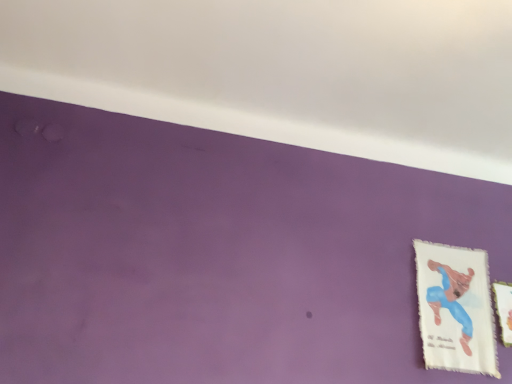
Question: Does white fabric picture frame at right, placed as the second picture frame when sorted from left to right, lie behind white fabric picture frame at lower right, which is the second picture frame in right-to-left order?

Choices:
 (A) no
 (B) yes

Answer: (B)

Question: Can you confirm if white fabric picture frame at right, placed as the second picture frame when sorted from left to right, is bigger than white fabric picture frame at lower right, acting as the first picture frame starting from the left?

Choices:
 (A) no
 (B) yes

Answer: (A)

Question: Is white fabric picture frame at right, the 1th picture frame when ordered from right to left, looking in the opposite direction of white fabric picture frame at lower right, which is the second picture frame in right-to-left order?

Choices:
 (A) no
 (B) yes

Answer: (A)

Question: Would you say white fabric picture frame at right, placed as the second picture frame when sorted from left to right, contains white fabric picture frame at lower right, which is the second picture frame in right-to-left order?

Choices:
 (A) no
 (B) yes

Answer: (A)

Question: From a real-world perspective, is white fabric picture frame at right, the 1th picture frame when ordered from right to left, below white fabric picture frame at lower right, acting as the first picture frame starting from the left?

Choices:
 (A) no
 (B) yes

Answer: (A)

Question: Is white fabric picture frame at right, placed as the second picture frame when sorted from left to right, far from white fabric picture frame at lower right, acting as the first picture frame starting from the left?

Choices:
 (A) no
 (B) yes

Answer: (A)

Question: Could you tell me if white fabric picture frame at lower right, acting as the first picture frame starting from the left, is turned towards white fabric picture frame at right, the 1th picture frame when ordered from right to left?

Choices:
 (A) no
 (B) yes

Answer: (A)

Question: From a real-world perspective, is white fabric picture frame at lower right, which is the second picture frame in right-to-left order, on white fabric picture frame at right, placed as the second picture frame when sorted from left to right?

Choices:
 (A) no
 (B) yes

Answer: (A)

Question: Is white fabric picture frame at right, placed as the second picture frame when sorted from left to right, completely or partially inside white fabric picture frame at lower right, acting as the first picture frame starting from the left?

Choices:
 (A) no
 (B) yes

Answer: (A)

Question: Does white fabric picture frame at lower right, acting as the first picture frame starting from the left, appear on the right side of white fabric picture frame at right, the 1th picture frame when ordered from right to left?

Choices:
 (A) no
 (B) yes

Answer: (A)

Question: Is white fabric picture frame at lower right, which is the second picture frame in right-to-left order, shorter than white fabric picture frame at right, the 1th picture frame when ordered from right to left?

Choices:
 (A) yes
 (B) no

Answer: (B)

Question: Is white fabric picture frame at lower right, acting as the first picture frame starting from the left, positioned before white fabric picture frame at right, the 1th picture frame when ordered from right to left?

Choices:
 (A) yes
 (B) no

Answer: (A)

Question: Relative to white fabric picture frame at lower right, acting as the first picture frame starting from the left, is white fabric picture frame at right, the 1th picture frame when ordered from right to left, in front or behind?

Choices:
 (A) front
 (B) behind

Answer: (B)